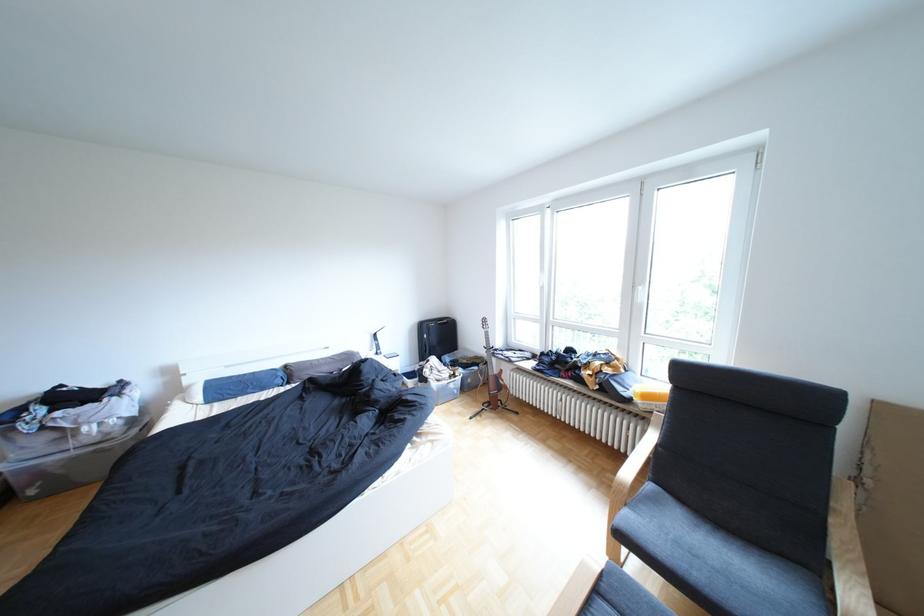
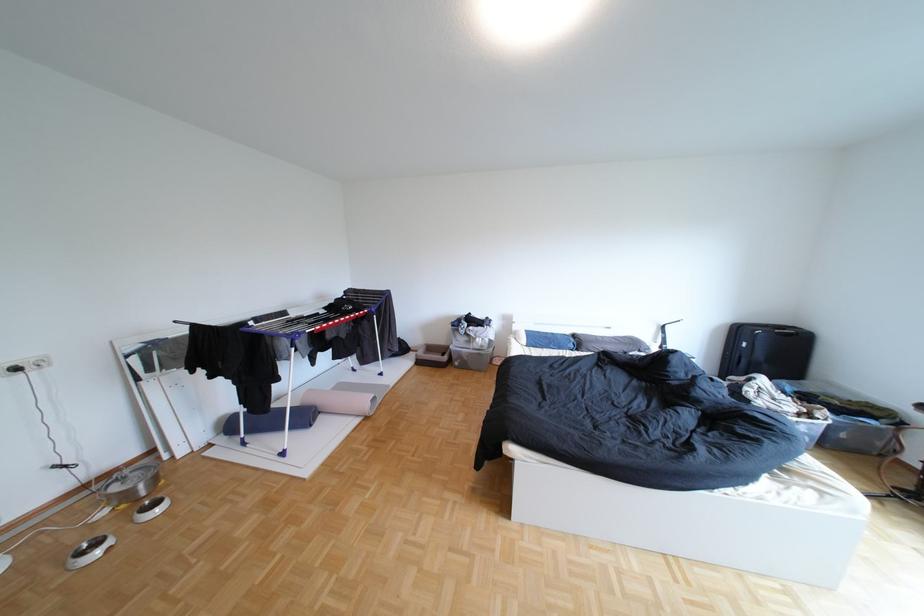
Locate, in the second image, the point that corresponds to the point at 301,367 in the first image.

(590, 336)